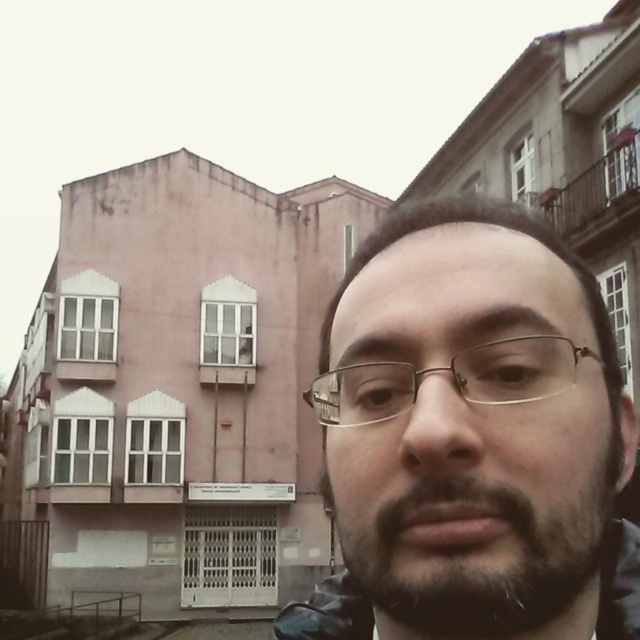
Looking at the person in the image, which feature is located higher up on their face between the dark brown hair at upper center and the dark brown stubble at center?

The dark brown hair at upper center is located higher up on the person face than the dark brown stubble at center.

You are looking at the image and notice two points marked in the scene. The first point, point (552, 552), is near the person in the foreground, while the second point, point (321, 396), is somewhere in the background. Which point is closer to you, the viewer?

Point (552, 552) is in front of point (321, 396), so it is closer to the viewer.